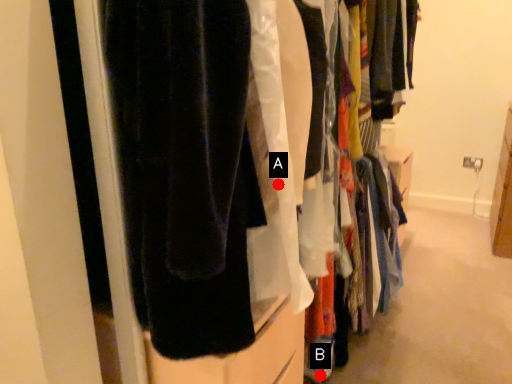
Question: Two points are circled on the image, labeled by A and B beside each circle. Which of the following is the farthest from the observer?

Choices:
 (A) A is further
 (B) B is further

Answer: (B)